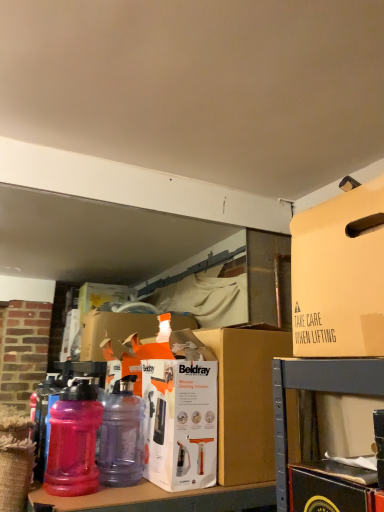
Question: Based on their positions, is brown cardboard box at center located to the left or right of beige cardboard box at upper right?

Choices:
 (A) left
 (B) right

Answer: (A)

Question: From a real-world perspective, is brown cardboard box at center above or below beige cardboard box at upper right?

Choices:
 (A) below
 (B) above

Answer: (A)

Question: Based on their relative distances, which object is farther from the brown cardboard box at center?

Choices:
 (A) translucent purple bottle at center, which ranks as the 2th bottle in left-to-right order
 (B) beige cardboard box at upper right
 (C) pink translucent water bottle at lower left, the 2th bottle viewed from the right

Answer: (B)

Question: Which of these objects is positioned farthest from the translucent purple bottle at center, which is counted as the 1th bottle, starting from the right?

Choices:
 (A) brown cardboard box at center
 (B) pink translucent water bottle at lower left, the 2th bottle viewed from the right
 (C) beige cardboard box at upper right

Answer: (C)